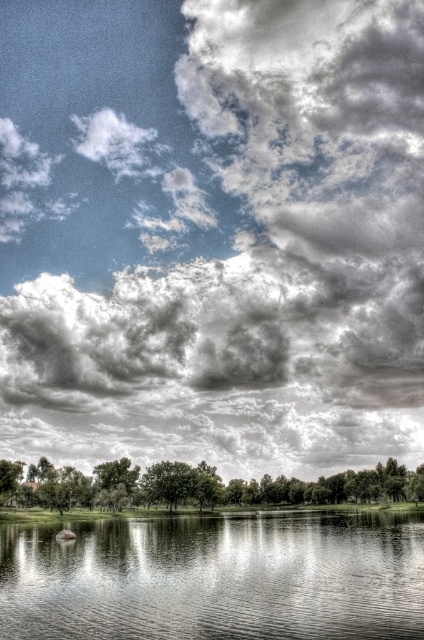
You are standing at the edge of the water and looking towards the center of the image. Which object, the cloudy sky at upper center or the transparent water at center, is positioned higher in the scene?

The cloudy sky at upper center is positioned higher than the transparent water at center in the scene.

You are standing at the edge of the serene lake and notice two points in the scene. The first point is at coordinates point (116, 205) and the second is at point (396, 627). Which point is closer to you?

Point (116, 205) is closer to you because it is further to the viewer than point (396, 627).